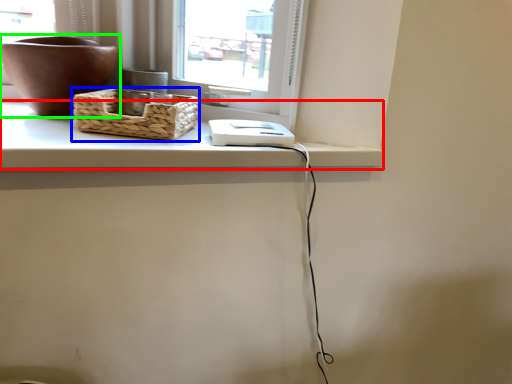
Question: Estimate the real-world distances between objects in this image. Which object is farther from counter top (highlighted by a red box), picnic basket (highlighted by a blue box) or flowerpot (highlighted by a green box)?

Choices:
 (A) picnic basket
 (B) flowerpot

Answer: (B)